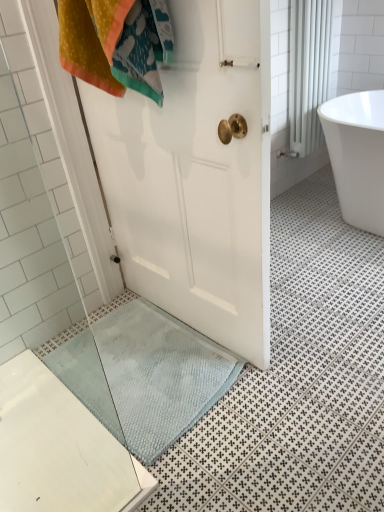
Question: Is blue textured bath mat at lower center to the left of white glossy radiator at upper right from the viewer's perspective?

Choices:
 (A) no
 (B) yes

Answer: (B)

Question: Could you tell me if blue textured bath mat at lower center is facing white glossy radiator at upper right?

Choices:
 (A) no
 (B) yes

Answer: (A)

Question: Does blue textured bath mat at lower center appear on the right side of white glossy radiator at upper right?

Choices:
 (A) yes
 (B) no

Answer: (B)

Question: Is blue textured bath mat at lower center looking in the opposite direction of white glossy radiator at upper right?

Choices:
 (A) no
 (B) yes

Answer: (A)

Question: Considering the relative sizes of blue textured bath mat at lower center and white glossy radiator at upper right in the image provided, is blue textured bath mat at lower center shorter than white glossy radiator at upper right?

Choices:
 (A) no
 (B) yes

Answer: (B)

Question: Are blue textured bath mat at lower center and white glossy radiator at upper right far apart?

Choices:
 (A) yes
 (B) no

Answer: (A)

Question: Is white glossy bathtub at upper right positioned before white glossy radiator at upper right?

Choices:
 (A) yes
 (B) no

Answer: (A)

Question: Is the depth of white glossy bathtub at upper right greater than that of white glossy radiator at upper right?

Choices:
 (A) no
 (B) yes

Answer: (A)

Question: Are white glossy bathtub at upper right and white glossy radiator at upper right making contact?

Choices:
 (A) no
 (B) yes

Answer: (A)

Question: Does white glossy bathtub at upper right have a greater width compared to white glossy radiator at upper right?

Choices:
 (A) no
 (B) yes

Answer: (B)

Question: Is white glossy bathtub at upper right positioned far away from white glossy radiator at upper right?

Choices:
 (A) yes
 (B) no

Answer: (B)

Question: Is white glossy bathtub at upper right looking in the opposite direction of white glossy radiator at upper right?

Choices:
 (A) yes
 (B) no

Answer: (B)

Question: Does white glossy radiator at upper right come behind white glossy bathtub at upper right?

Choices:
 (A) no
 (B) yes

Answer: (B)